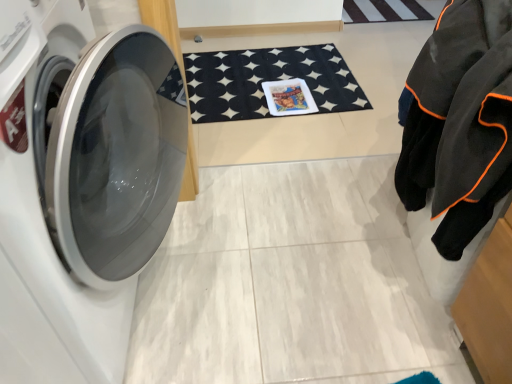
Question: Is black fleece jacket at right outside black felt bath mat at center?

Choices:
 (A) no
 (B) yes

Answer: (B)

Question: From a real-world perspective, is black fleece jacket at right physically below black felt bath mat at center?

Choices:
 (A) yes
 (B) no

Answer: (B)

Question: Does black fleece jacket at right have a greater width compared to black felt bath mat at center?

Choices:
 (A) yes
 (B) no

Answer: (B)

Question: Would you say black fleece jacket at right contains black felt bath mat at center?

Choices:
 (A) yes
 (B) no

Answer: (B)

Question: Considering the relative sizes of black fleece jacket at right and black felt bath mat at center in the image provided, is black fleece jacket at right shorter than black felt bath mat at center?

Choices:
 (A) yes
 (B) no

Answer: (B)

Question: From the image's perspective, is black felt bath mat at center above or below white glossy washing machine at left?

Choices:
 (A) below
 (B) above

Answer: (B)

Question: From a real-world perspective, is black felt bath mat at center positioned above or below white glossy washing machine at left?

Choices:
 (A) above
 (B) below

Answer: (B)

Question: Considering the relative positions of black felt bath mat at center and white glossy washing machine at left in the image provided, is black felt bath mat at center to the left or to the right of white glossy washing machine at left?

Choices:
 (A) right
 (B) left

Answer: (A)

Question: Considering the positions of black felt bath mat at center and white glossy washing machine at left in the image, is black felt bath mat at center taller or shorter than white glossy washing machine at left?

Choices:
 (A) tall
 (B) short

Answer: (B)

Question: Is white glossy washing machine at left in front of or behind black felt bath mat at center in the image?

Choices:
 (A) behind
 (B) front

Answer: (B)

Question: Is white glossy washing machine at left bigger or smaller than black felt bath mat at center?

Choices:
 (A) small
 (B) big

Answer: (B)

Question: Considering the positions of white glossy washing machine at left and black felt bath mat at center in the image, is white glossy washing machine at left taller or shorter than black felt bath mat at center?

Choices:
 (A) tall
 (B) short

Answer: (A)

Question: Would you say white glossy washing machine at left is to the left or to the right of black felt bath mat at center in the picture?

Choices:
 (A) left
 (B) right

Answer: (A)

Question: From a real-world perspective, is black felt bath mat at center positioned above or below black fleece jacket at right?

Choices:
 (A) above
 (B) below

Answer: (B)

Question: Is point (208, 69) positioned closer to the camera than point (485, 84)?

Choices:
 (A) closer
 (B) farther

Answer: (B)